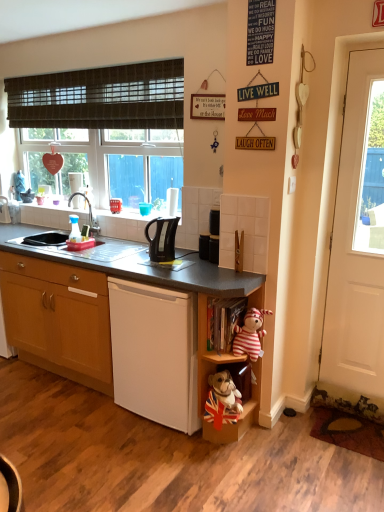
At what (x,y) coordinates should I click in order to perform the action: click on vacant point to the right of wooden bookshelf at lower center, acting as the 1th shelf starting from the bottom. Please return your answer as a coordinate pair (x, y). This screenshot has width=384, height=512. Looking at the image, I should click on (286, 436).